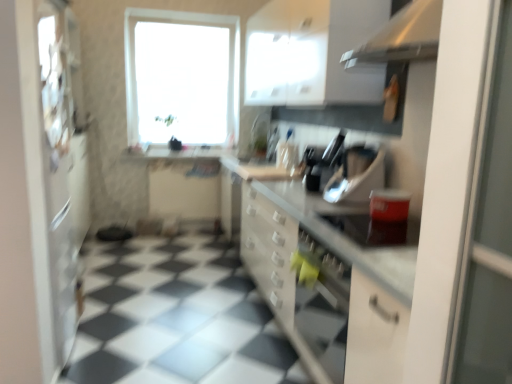
This screenshot has width=512, height=384. I want to click on vacant area located to the right-hand side of white matte refrigerator at left, so click(x=120, y=349).